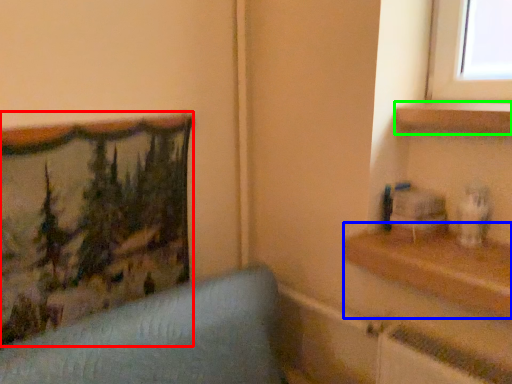
Question: Considering the real-world distances, which object is closest to picture frame (highlighted by a red box)? shelf (highlighted by a blue box) or shelf (highlighted by a green box).

Choices:
 (A) shelf
 (B) shelf

Answer: (A)